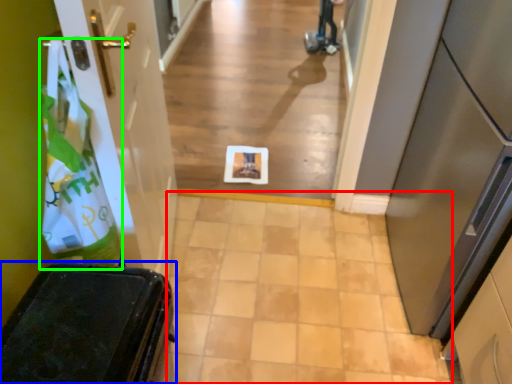
Question: Estimate the real-world distances between objects in this image. Which object is closer to path (highlighted by a red box), furniture (highlighted by a blue box) or shopping bag (highlighted by a green box)?

Choices:
 (A) furniture
 (B) shopping bag

Answer: (A)